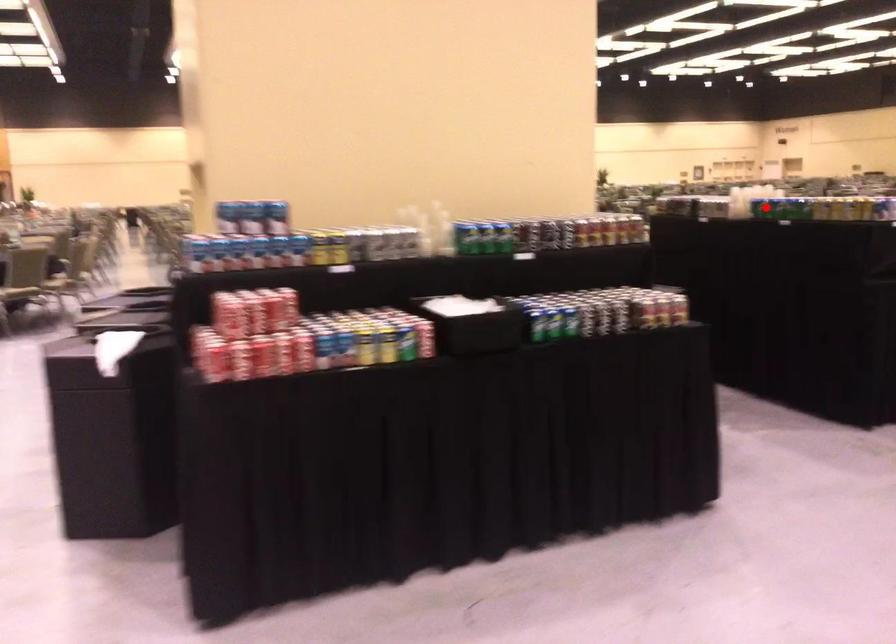
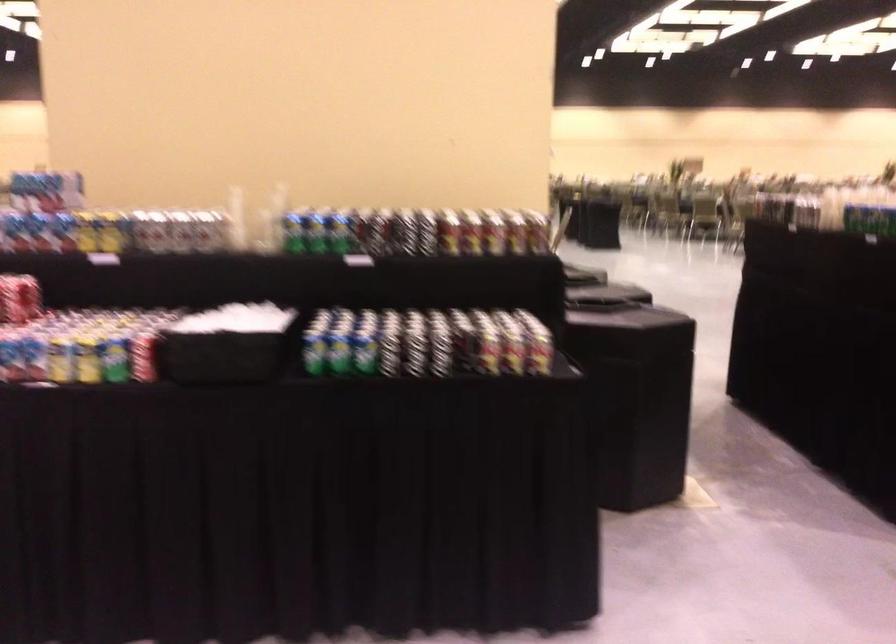
Question: I am providing you with two images of the same scene from different viewpoints. A red point is marked on the first image. Is the red point's position out of view in image 2?

Choices:
 (A) Yes
 (B) No

Answer: (A)